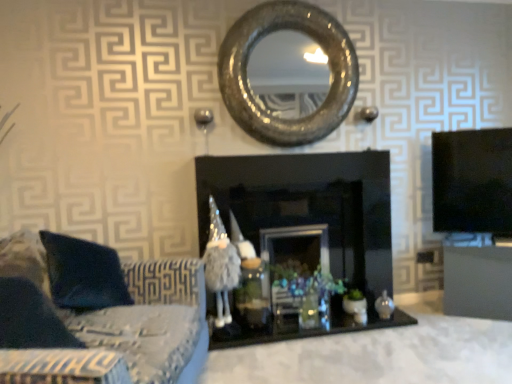
Question: Would you consider suede-like fabric couch at lower left to be distant from fuzzy fabric wizard at center?

Choices:
 (A) yes
 (B) no

Answer: (B)

Question: Is suede-like fabric couch at lower left further to camera compared to fuzzy fabric wizard at center?

Choices:
 (A) no
 (B) yes

Answer: (A)

Question: Does suede-like fabric couch at lower left appear on the right side of fuzzy fabric wizard at center?

Choices:
 (A) no
 (B) yes

Answer: (A)

Question: Can you confirm if suede-like fabric couch at lower left is bigger than fuzzy fabric wizard at center?

Choices:
 (A) yes
 (B) no

Answer: (A)

Question: Is suede-like fabric couch at lower left oriented towards fuzzy fabric wizard at center?

Choices:
 (A) no
 (B) yes

Answer: (A)

Question: From the image's perspective, is suede-like fabric couch at lower left above or below shiny metallic mirror at center?

Choices:
 (A) below
 (B) above

Answer: (A)

Question: Is suede-like fabric couch at lower left inside the boundaries of shiny metallic mirror at center, or outside?

Choices:
 (A) outside
 (B) inside

Answer: (A)

Question: From a real-world perspective, is suede-like fabric couch at lower left above or below shiny metallic mirror at center?

Choices:
 (A) above
 (B) below

Answer: (B)

Question: Considering the positions of suede-like fabric couch at lower left and shiny metallic mirror at center in the image, is suede-like fabric couch at lower left taller or shorter than shiny metallic mirror at center?

Choices:
 (A) tall
 (B) short

Answer: (B)

Question: From their relative heights in the image, would you say suede-like fabric couch at lower left is taller or shorter than fuzzy fabric wizard at center?

Choices:
 (A) short
 (B) tall

Answer: (A)

Question: In terms of size, does suede-like fabric couch at lower left appear bigger or smaller than fuzzy fabric wizard at center?

Choices:
 (A) big
 (B) small

Answer: (A)

Question: From the image's perspective, is suede-like fabric couch at lower left above or below fuzzy fabric wizard at center?

Choices:
 (A) above
 (B) below

Answer: (B)

Question: Is suede-like fabric couch at lower left wider or thinner than fuzzy fabric wizard at center?

Choices:
 (A) thin
 (B) wide

Answer: (B)

Question: Looking at the image, does matte black cabinet at right seem bigger or smaller compared to fuzzy fabric wizard at center?

Choices:
 (A) big
 (B) small

Answer: (A)

Question: In the image, is matte black cabinet at right on the left side or the right side of fuzzy fabric wizard at center?

Choices:
 (A) left
 (B) right

Answer: (B)